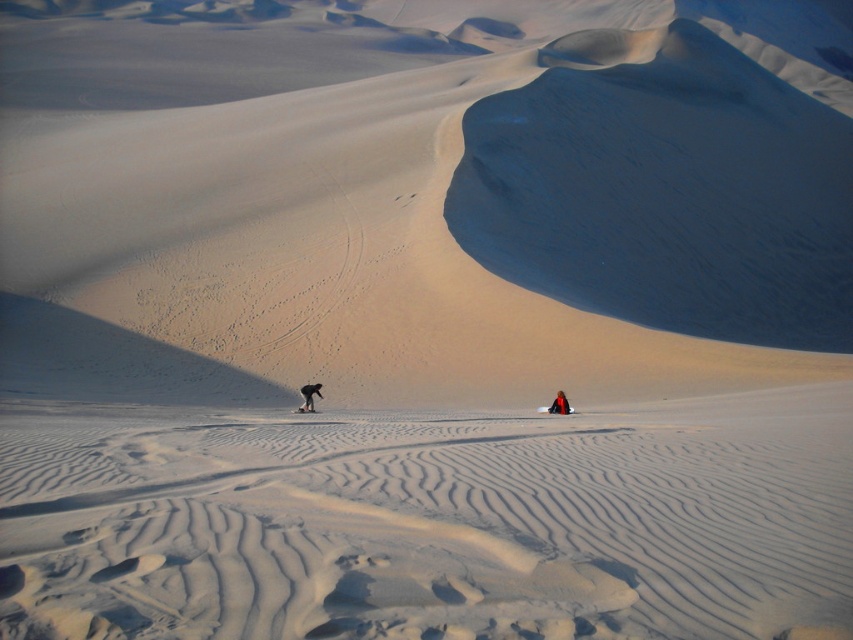
Is the position of dark brown sandboarder at lower center more distant than that of matte black ski at center?

Yes, it is behind matte black ski at center.

Is dark brown sandboarder at lower center to the left of matte black ski at center from the viewer's perspective?

In fact, dark brown sandboarder at lower center is to the right of matte black ski at center.

Who is more forward, (312, 403) or (299, 412)?

Point (299, 412) is in front.

This screenshot has height=640, width=853. I want to click on dark brown sandboarder at lower center, so [x=309, y=396].

Measure the distance between point (183, 138) and camera.

Point (183, 138) is 100.71 meters from camera.

Is point (798, 67) more distant than point (299, 410)?

That is True.

The height and width of the screenshot is (640, 853). Identify the location of smooth sand dune at center. (424, 195).

Is smooth sand dune at center positioned before orange fabric person at lower right?

No, it is not.

Between smooth sand dune at center and orange fabric person at lower right, which one appears on the right side from the viewer's perspective?

smooth sand dune at center is more to the right.

Is point (840, 248) less distant than point (555, 401)?

No, (840, 248) is behind (555, 401).

Where is `smooth sand dune at center`? This screenshot has width=853, height=640. smooth sand dune at center is located at coordinates (424, 195).